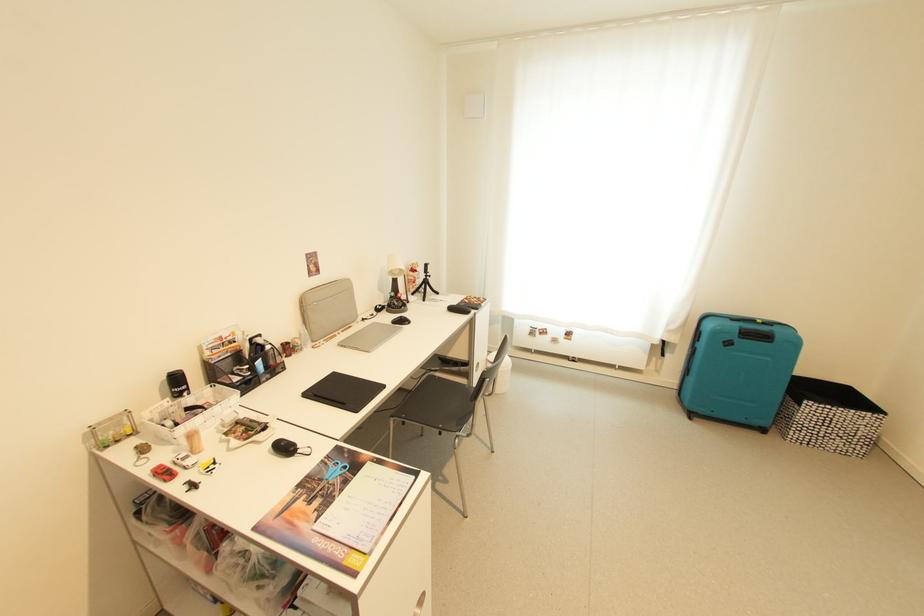
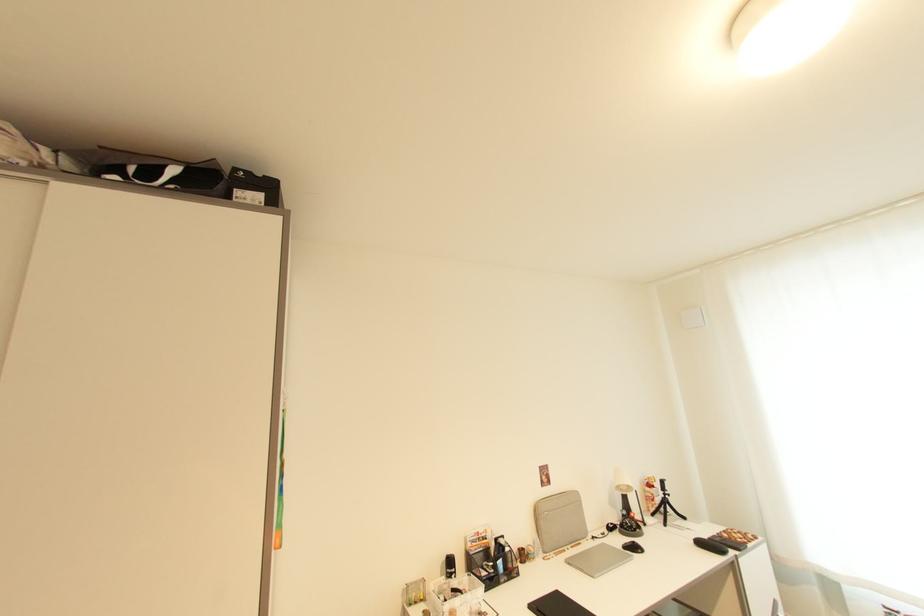
The point at (407, 323) is marked in the first image. Where is the corresponding point in the second image?

(639, 549)